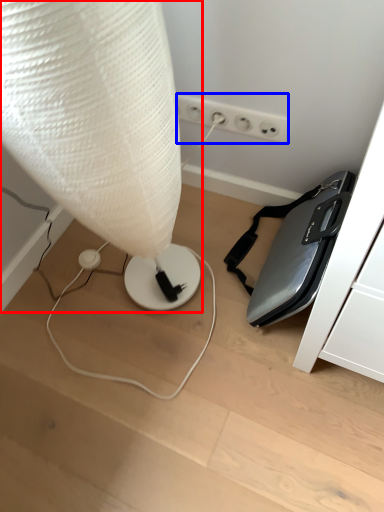
Question: Which point is closer to the camera, lamp (highlighted by a red box) or electric outlet (highlighted by a blue box)?

Choices:
 (A) lamp
 (B) electric outlet

Answer: (A)